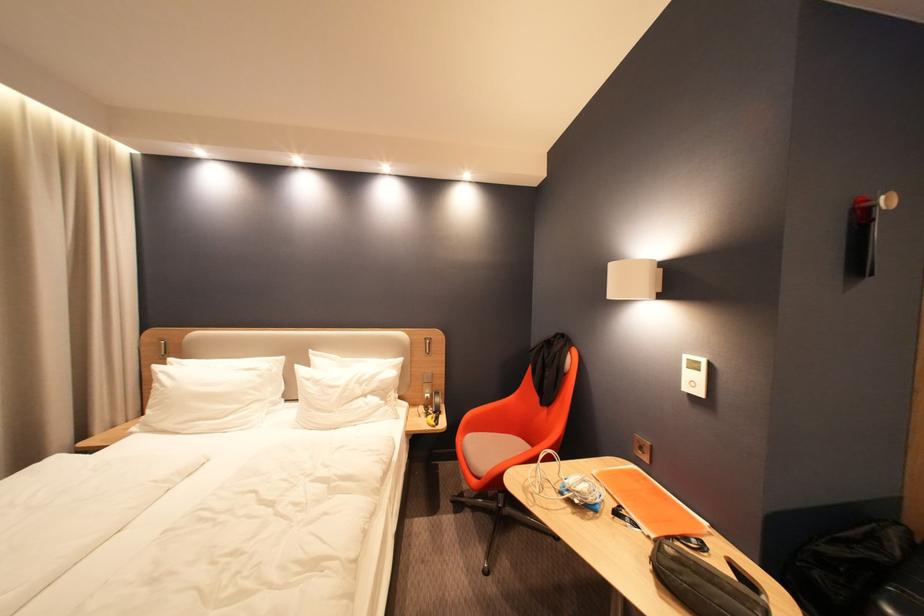
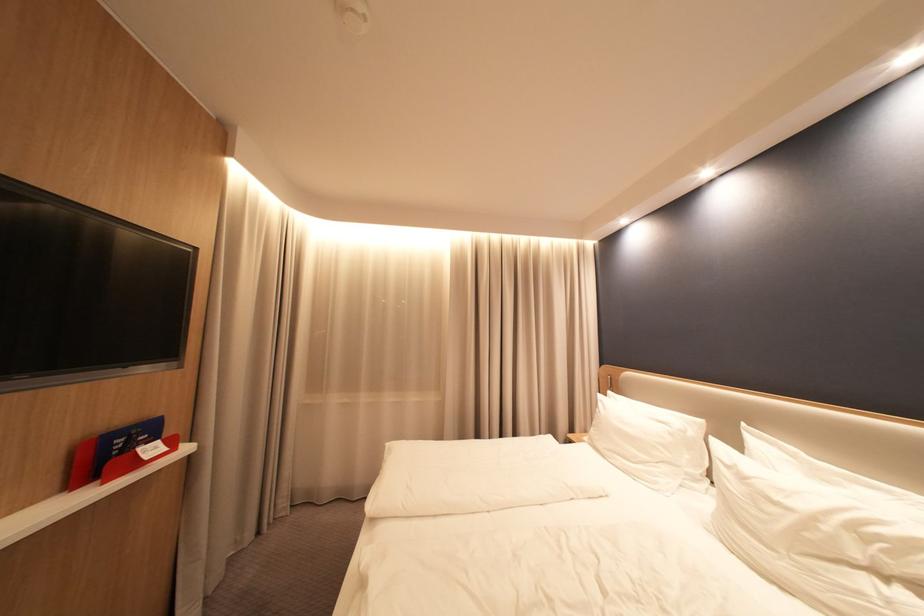
The point at (175, 365) is marked in the first image. Where is the corresponding point in the second image?

(615, 397)